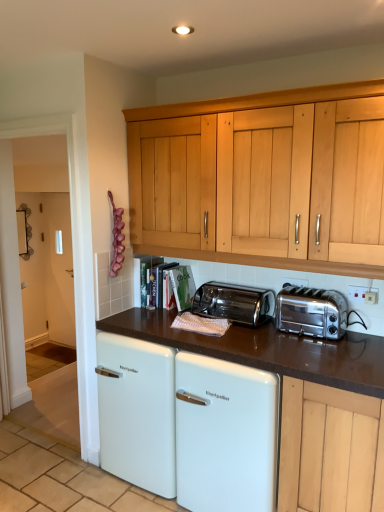
Locate an element on the screen. vacant area that is in front of polished stainless steel toaster at center, placed as the 2th toaster when sorted from right to left is located at coordinates (251, 336).